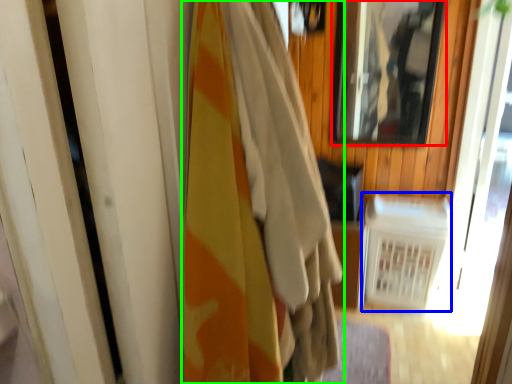
Question: Which object is the farthest from mirror (highlighted by a red box)? Choose among these: radiator (highlighted by a blue box) or curtain (highlighted by a green box).

Choices:
 (A) radiator
 (B) curtain

Answer: (B)